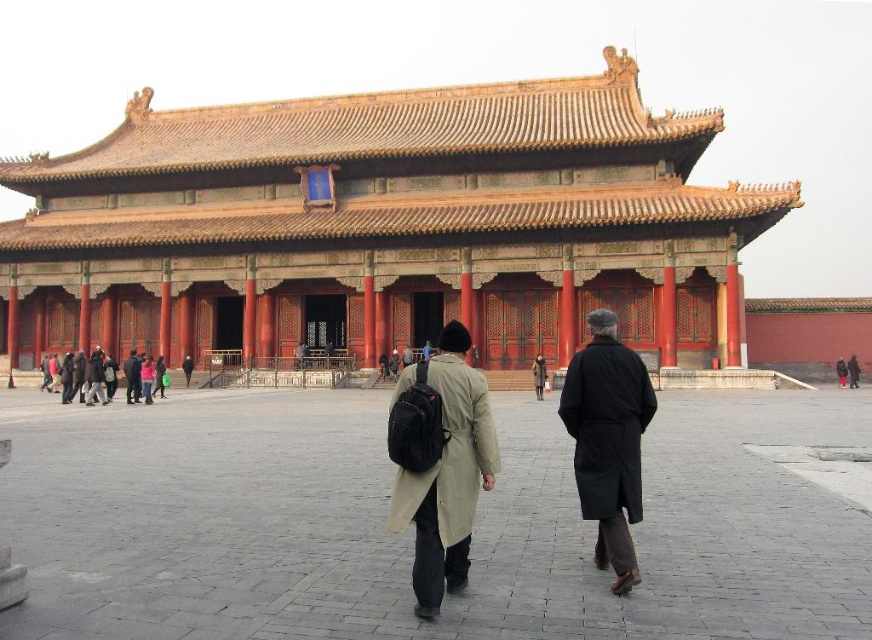
The width and height of the screenshot is (872, 640). Describe the element at coordinates (608, 440) in the screenshot. I see `black wool coat at center` at that location.

Between black wool coat at center and dark gray wool coat at center, which one is positioned higher?

black wool coat at center

Measure the distance between point [608,499] and camera.

27.02 meters

In order to click on black wool coat at center in this screenshot , I will do `click(608, 440)`.

Is matte orange wood palace at center closer to the viewer compared to matte black backpack at center?

Yes, matte orange wood palace at center is closer to the viewer.

Who is more distant from viewer, (344, 106) or (78, 384)?

Positioned behind is point (344, 106).

Based on the photo, measure the distance between point (x=637, y=346) and camera.

A distance of 64.72 meters exists between point (x=637, y=346) and camera.

Identify the location of matte orange wood palace at center. (386, 227).

Can you confirm if matte orange wood palace at center is positioned below black wool coat at center?

Incorrect, matte orange wood palace at center is not positioned below black wool coat at center.

This screenshot has width=872, height=640. Find the location of `matte orange wood palace at center`. matte orange wood palace at center is located at coordinates (386, 227).

This screenshot has height=640, width=872. I want to click on matte orange wood palace at center, so click(386, 227).

I want to click on matte orange wood palace at center, so click(x=386, y=227).